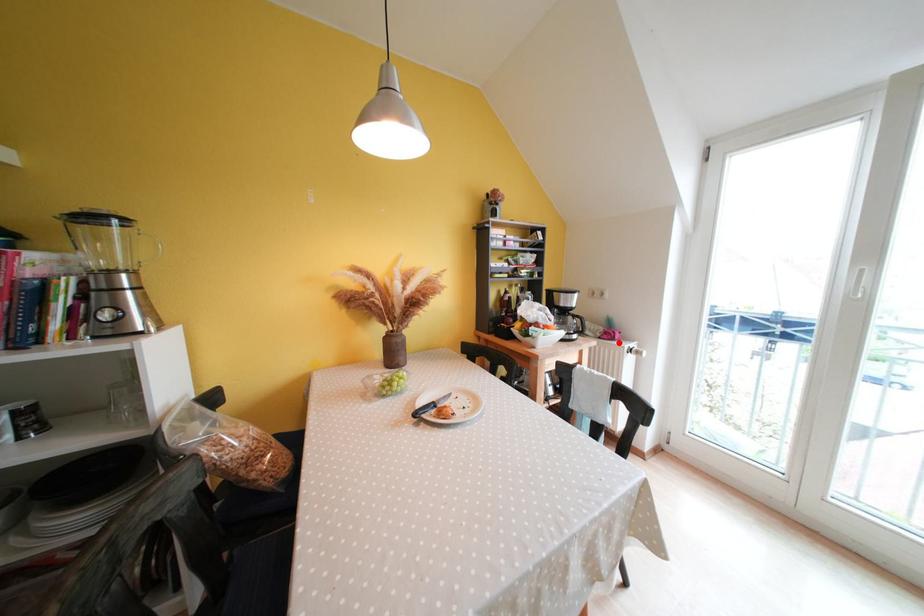
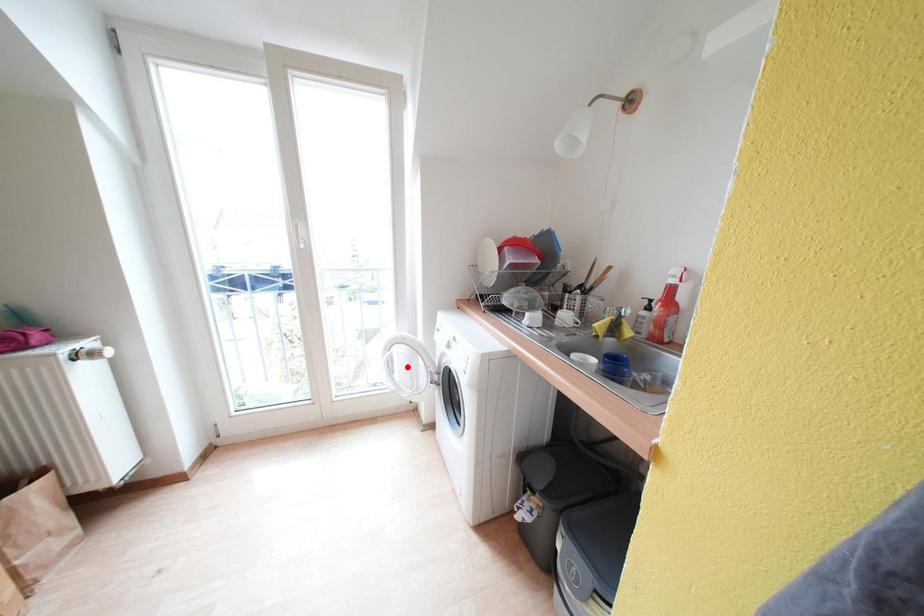
I am providing you with two images of the same scene from different viewpoints. A red point is marked on the first image and another point is marked on the second image. Are the points marked in image1 and image2 representing the same 3D position?

No